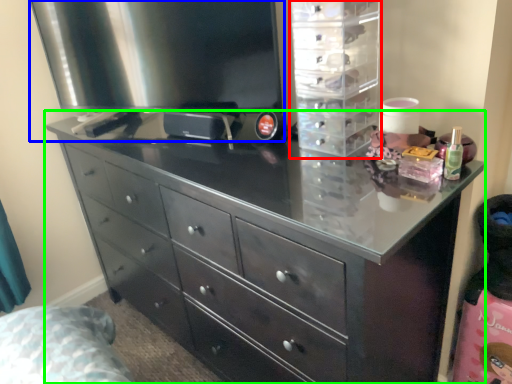
Question: Which object is positioned closest to cabinet (highlighted by a red box)? Select from appliance (highlighted by a blue box) and chest of drawers (highlighted by a green box).

Choices:
 (A) appliance
 (B) chest of drawers

Answer: (A)